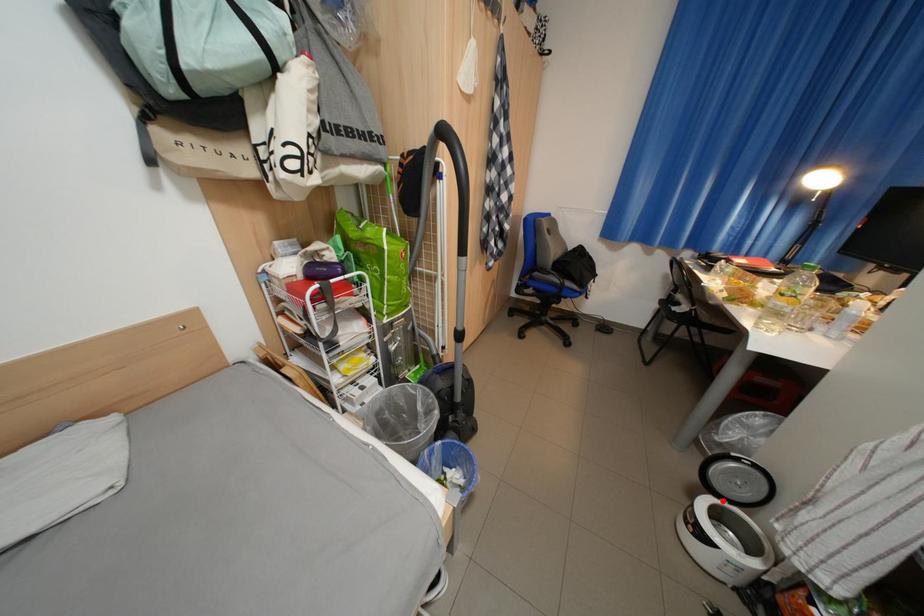
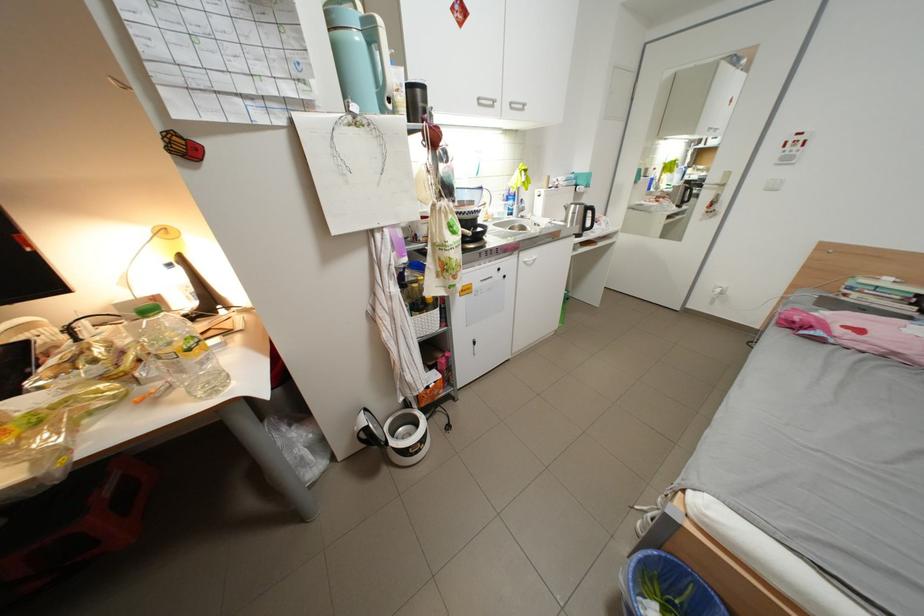
Where in the second image is the point corresponding to the highlighted location from the first image?

(404, 444)